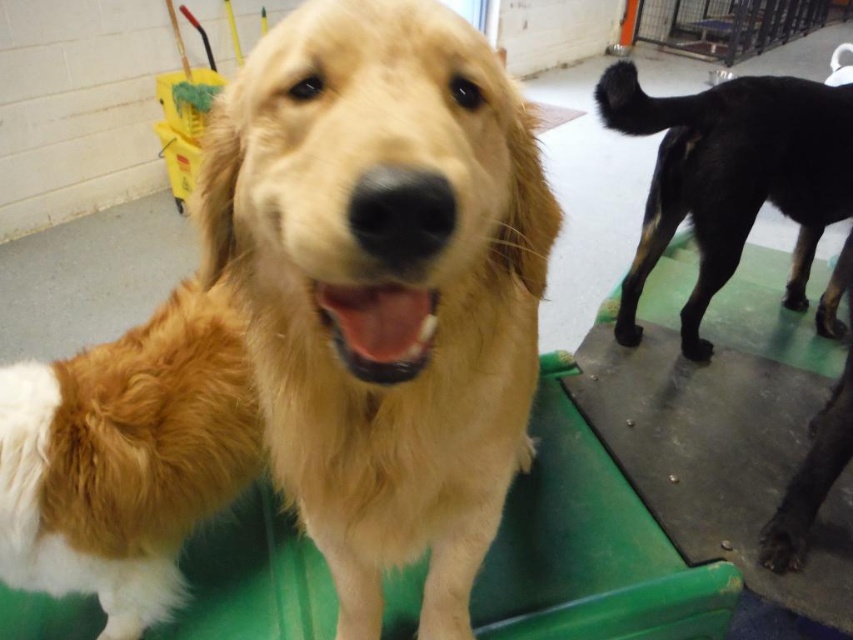
What do you see at coordinates (383, 285) in the screenshot? I see `golden fur dog at center` at bounding box center [383, 285].

From the picture: Is golden fur dog at center to the right of black glossy dog at right from the viewer's perspective?

No, golden fur dog at center is not to the right of black glossy dog at right.

Who is more distant from viewer, (401,250) or (804,147)?

The point (804,147) is behind.

Find the location of a particular element. golden fur dog at center is located at coordinates pos(383,285).